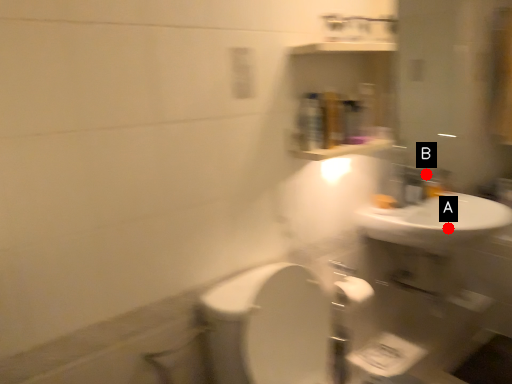
Question: Two points are circled on the image, labeled by A and B beside each circle. Which point appears farthest from the camera in this image?

Choices:
 (A) A is further
 (B) B is further

Answer: (B)